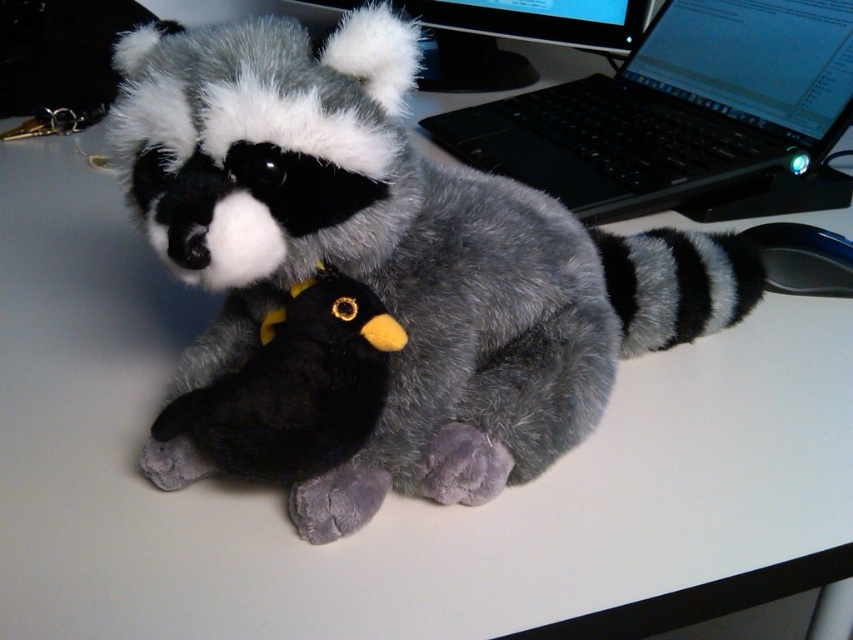
Question: Which of the following is the closest to the observer?

Choices:
 (A) fluffy gray raccoon at center
 (B) black plastic laptop at upper right
 (C) black glossy monitor at upper center
 (D) black plush bird at center

Answer: (A)

Question: Which point is closer to the camera taking this photo?

Choices:
 (A) (456, 72)
 (B) (538, 205)

Answer: (B)

Question: Does black plastic laptop at upper right appear under black plush bird at center?

Choices:
 (A) no
 (B) yes

Answer: (A)

Question: Is fluffy gray raccoon at center thinner than black plush bird at center?

Choices:
 (A) no
 (B) yes

Answer: (A)

Question: Can you confirm if fluffy gray raccoon at center is positioned to the left of black plastic laptop at upper right?

Choices:
 (A) no
 (B) yes

Answer: (B)

Question: Which point appears closest to the camera in this image?

Choices:
 (A) (422, 324)
 (B) (288, 474)
 (C) (432, 1)
 (D) (711, 147)

Answer: (B)